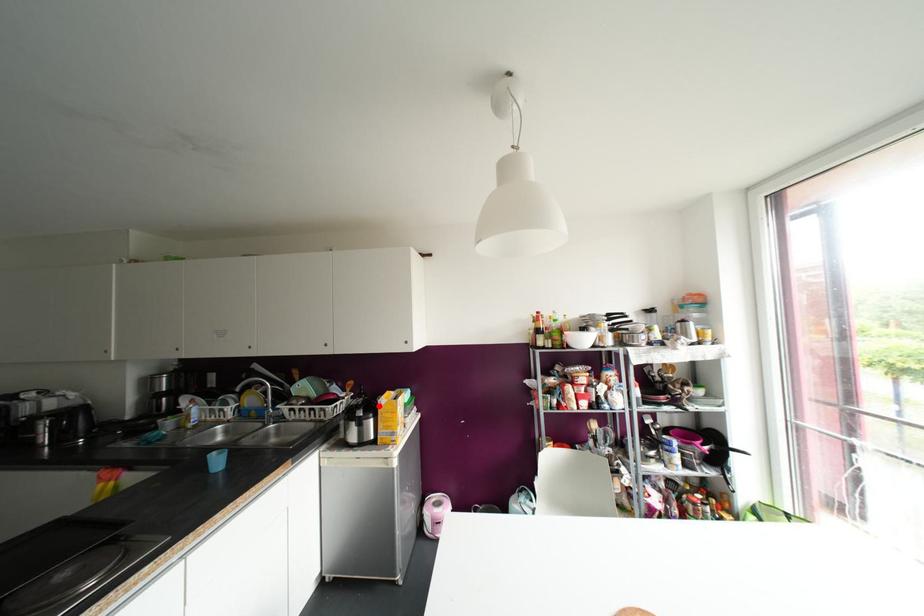
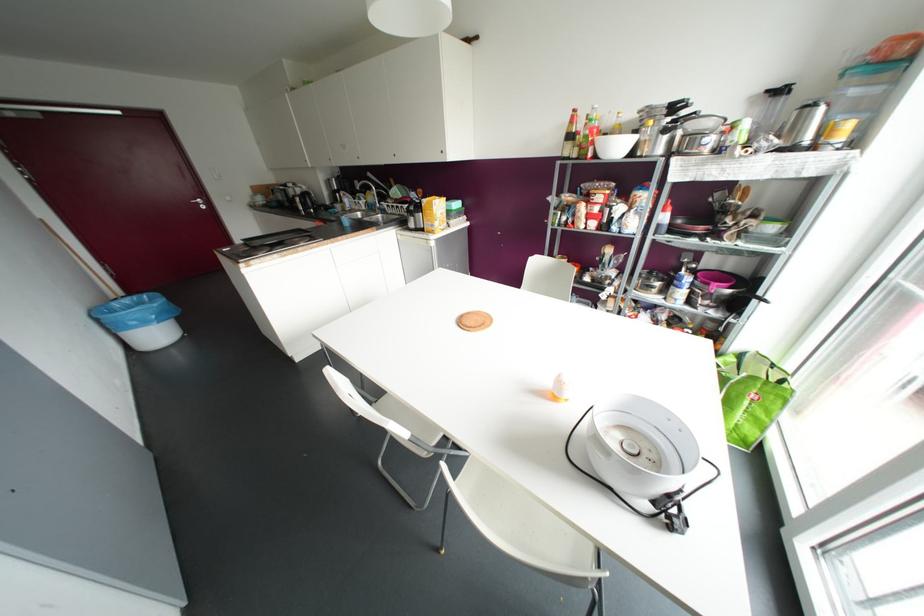
Question: I am providing you with two images of the same scene from different viewpoints. In image1, a red point is highlighted. Considering the same 3D point in image2, which of the following is correct?

Choices:
 (A) It is closer
 (B) It is farther

Answer: (A)